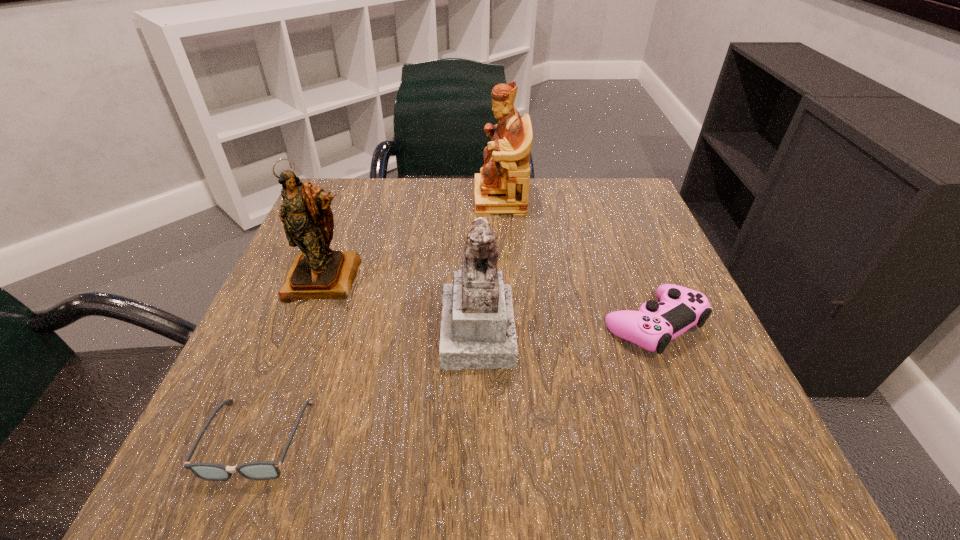
At what (x,y) coordinates should I click in order to perform the action: click on the farthest object. Please return your answer as a coordinate pair (x, y). This screenshot has width=960, height=540. Looking at the image, I should click on (502, 187).

This screenshot has width=960, height=540. Find the location of `the leftmost figurine`. the leftmost figurine is located at coordinates (317, 272).

The height and width of the screenshot is (540, 960). What are the coordinates of `control` in the screenshot? It's located at (655, 324).

This screenshot has height=540, width=960. I want to click on the rightmost object, so click(x=655, y=324).

Where is `the shortest object`? The width and height of the screenshot is (960, 540). the shortest object is located at coordinates (260, 470).

The width and height of the screenshot is (960, 540). I want to click on spectacles, so click(260, 470).

Where is `vacant region located on the front-facing side of the farthest object`? This screenshot has width=960, height=540. vacant region located on the front-facing side of the farthest object is located at coordinates (373, 199).

Image resolution: width=960 pixels, height=540 pixels. I want to click on free space located 0.210m on the front-facing side of the farthest object, so click(x=386, y=199).

The image size is (960, 540). I want to click on blank area located on the front-facing side of the farthest object, so click(412, 199).

Image resolution: width=960 pixels, height=540 pixels. What are the coordinates of `free location located on the front-facing side of the leftmost figurine` in the screenshot? It's located at (286, 377).